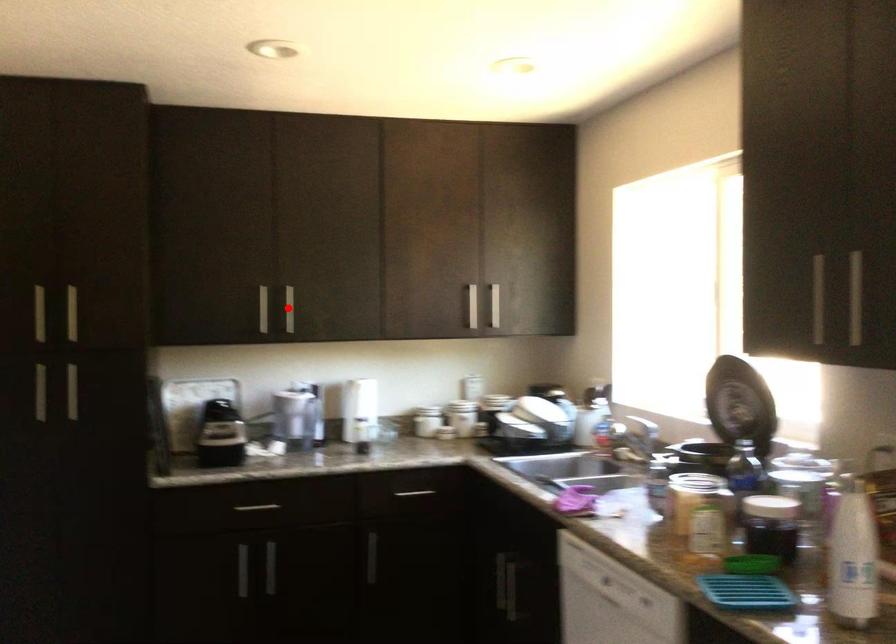
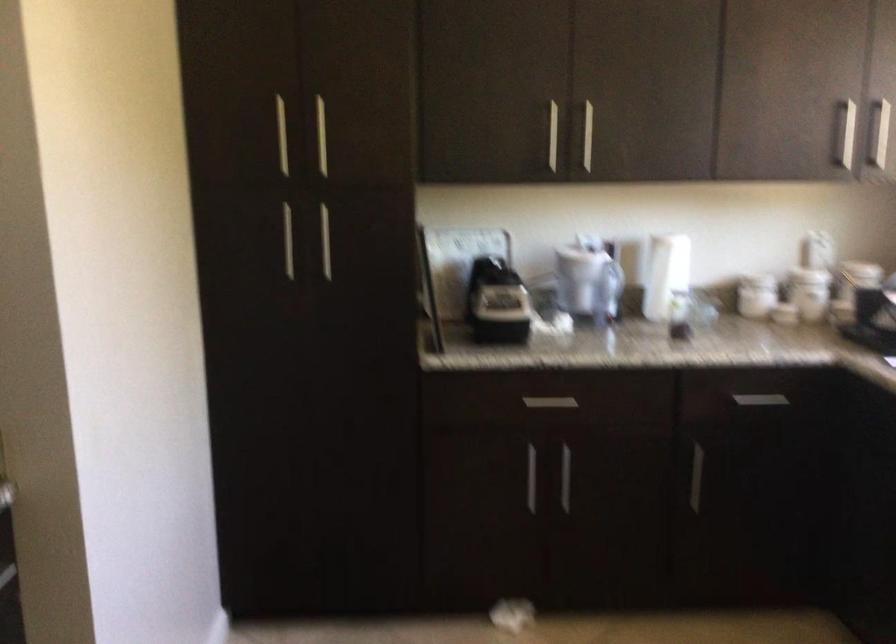
Question: I am providing you with two images of the same scene from different viewpoints. A red point is shown in image1. For the corresponding object point in image2, is it positioned nearer or farther from the camera?

Choices:
 (A) Nearer
 (B) Farther

Answer: (A)